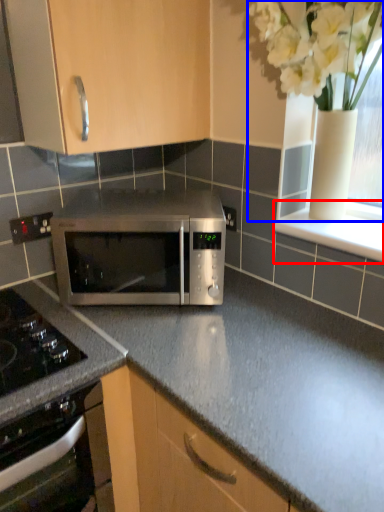
Question: Among these objects, which one is farthest to the camera, window sill (highlighted by a red box) or floral arrangement (highlighted by a blue box)?

Choices:
 (A) window sill
 (B) floral arrangement

Answer: (A)